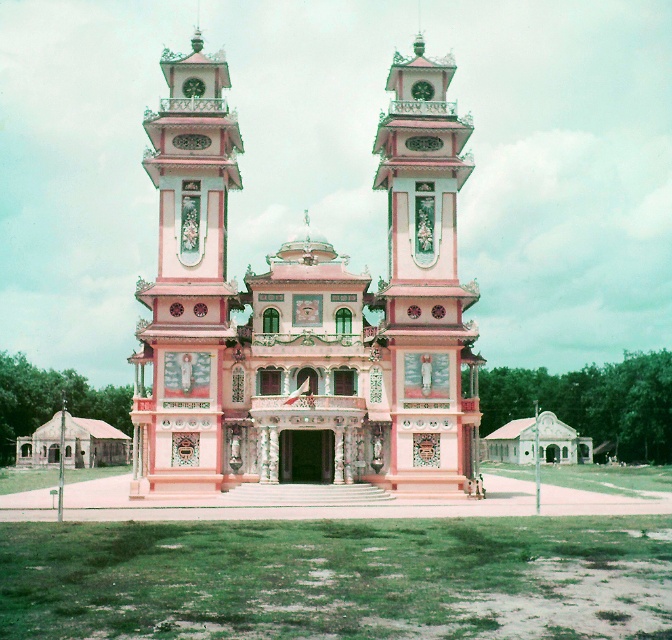
Question: Which point is closer to the camera?

Choices:
 (A) (206, 456)
 (B) (413, 444)

Answer: (A)

Question: Can you confirm if pink glossy clock tower at left is thinner than pink glossy bell tower at center?

Choices:
 (A) no
 (B) yes

Answer: (A)

Question: Does pink glossy clock tower at left appear under pink glossy bell tower at center?

Choices:
 (A) no
 (B) yes

Answer: (A)

Question: Can you confirm if pink glossy clock tower at left is wider than pink glossy bell tower at center?

Choices:
 (A) no
 (B) yes

Answer: (B)

Question: Which object is farther from the camera taking this photo?

Choices:
 (A) pink glossy clock tower at left
 (B) pink glossy bell tower at center

Answer: (B)